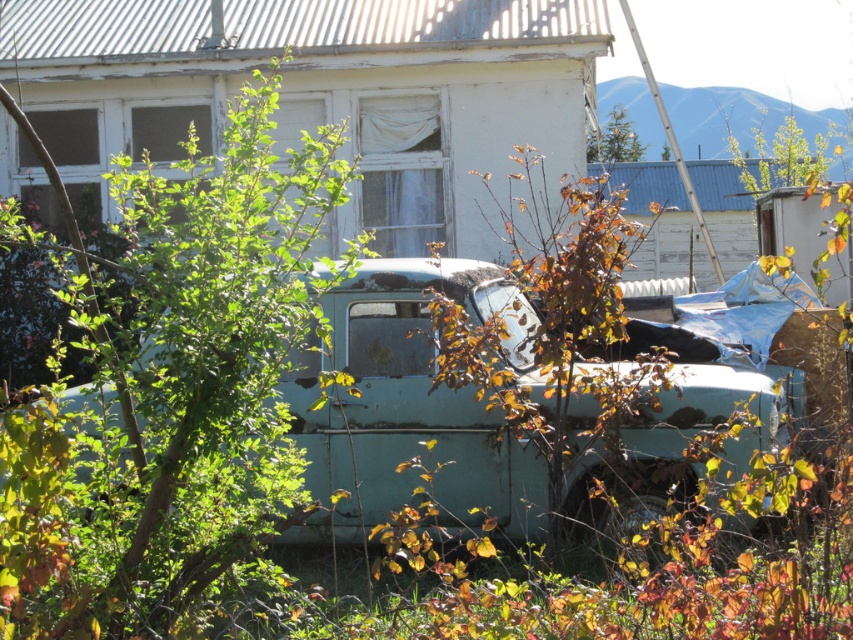
You are standing at the origin point of the coordinate system. You want to walk to the green leafy tree at center. In which direction should you move?

The green leafy tree at center is located at coordinate point 0.609 on the x axis and 0.204 on the y axis. Since you are at the origin point, you should move in the positive x and positive y direction to reach the green leafy tree at center.

You are a hiker who needs to park your vehicle. You see the teal matte pickup truck at center and the green leafy tree at upper center. Which object is above the other?

The green leafy tree at upper center is above the teal matte pickup truck at center because the teal matte pickup truck at center is positioned under it.